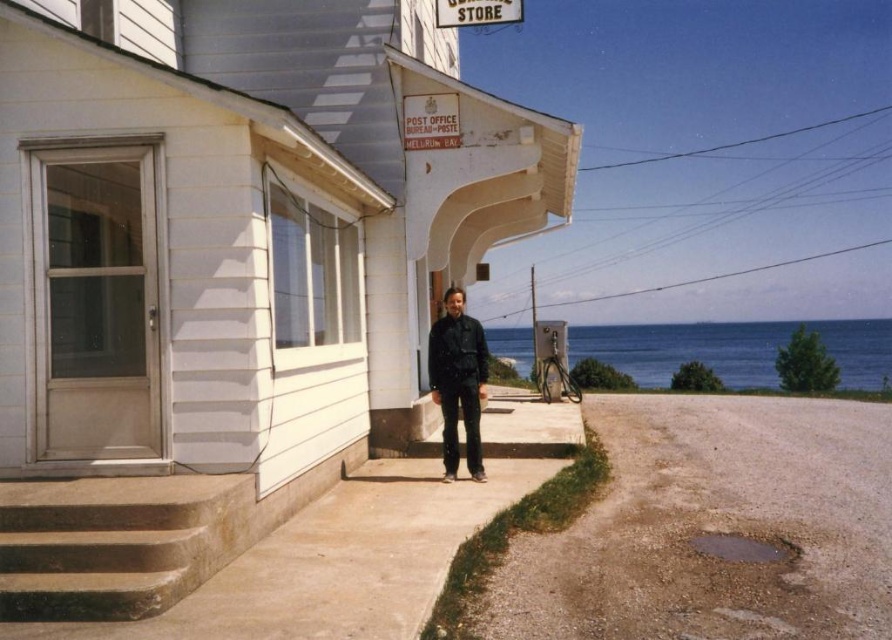
Question: Observing the image, what is the correct spatial positioning of dull gray asphalt at lower right in reference to blue water at lower right?

Choices:
 (A) right
 (B) left

Answer: (B)

Question: Which object is farther from the camera taking this photo?

Choices:
 (A) dull gray asphalt at lower right
 (B) blue water at lower right
 (C) brown concrete stairs at lower left
 (D) black matte jacket at center

Answer: (B)

Question: Does brown concrete stairs at lower left appear over blue water at lower right?

Choices:
 (A) no
 (B) yes

Answer: (B)

Question: Is dull gray asphalt at lower right wider than brown concrete stairs at lower left?

Choices:
 (A) no
 (B) yes

Answer: (B)

Question: Which is farther from the blue water at lower right?

Choices:
 (A) brown concrete stairs at lower left
 (B) black matte jacket at center

Answer: (A)

Question: Which of the following is the farthest from the observer?

Choices:
 (A) (163, 509)
 (B) (675, 627)

Answer: (A)